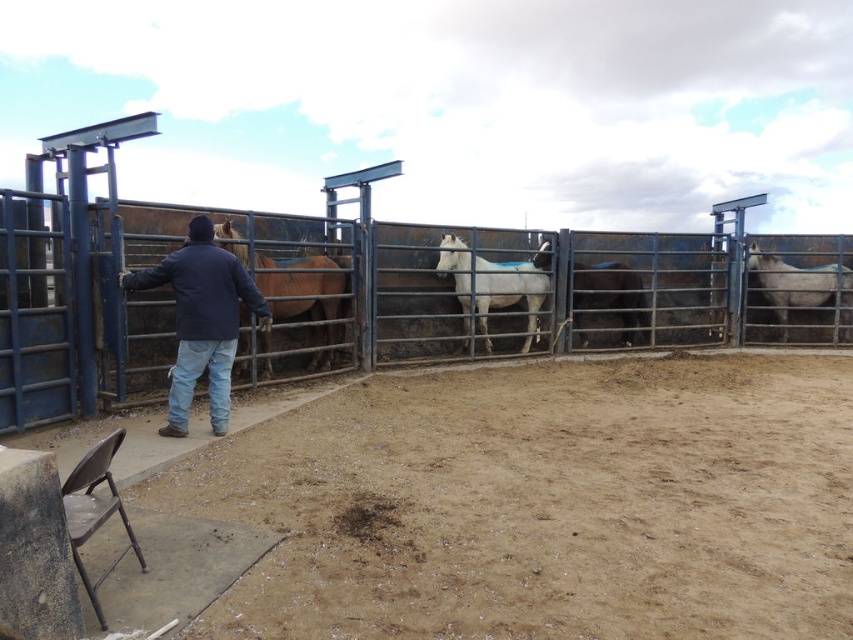
Is the position of brown matte horse at center more distant than that of white matte horse at center?

No, it is in front of white matte horse at center.

Is point (312, 304) behind point (596, 269)?

No, (312, 304) is in front of (596, 269).

Does point (213, 227) come in front of point (624, 310)?

That is True.

You are a GUI agent. You are given a task and a screenshot of the screen. Output one action in this format:
    pyautogui.click(x=<x>, y=<y>)
    Task: Click on the brown matte horse at center
    
    Given the screenshot: What is the action you would take?
    (x=299, y=282)

Is brown matte horse at center above white glossy horse at right?

Incorrect, brown matte horse at center is not positioned above white glossy horse at right.

Is point (331, 266) positioned before point (752, 250)?

Yes.

Identify the location of brown matte horse at center. 299,282.

What do you see at coordinates (543, 292) in the screenshot?
I see `rusty metal fence at center` at bounding box center [543, 292].

Does rusty metal fence at center have a lesser height compared to white glossy horse at right?

No, rusty metal fence at center is not shorter than white glossy horse at right.

Where is `rusty metal fence at center`? This screenshot has width=853, height=640. rusty metal fence at center is located at coordinates (543, 292).